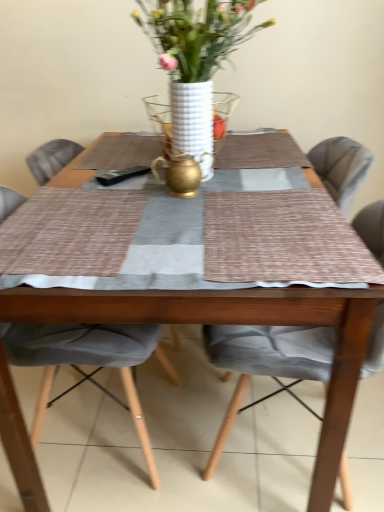
Question: Considering their positions, is wooden table at center located in front of or behind white textured vase at center?

Choices:
 (A) behind
 (B) front

Answer: (B)

Question: Is wooden table at center spatially inside white textured vase at center, or outside of it?

Choices:
 (A) inside
 (B) outside

Answer: (B)

Question: Which of these objects is positioned farthest from the gray fabric chair at center, placed as the 1th chair when sorted from left to right?

Choices:
 (A) wooden table at center
 (B) textured gray cushion at center, which is the 1th chair in right-to-left order
 (C) white textured vase at center
 (D) white ceramic vase at center

Answer: (C)

Question: Which object is the farthest from the gray fabric chair at center, placed as the 1th chair when sorted from left to right?

Choices:
 (A) textured gray cushion at center, which is the 1th chair in right-to-left order
 (B) white ceramic vase at center
 (C) white textured vase at center
 (D) wooden table at center

Answer: (C)